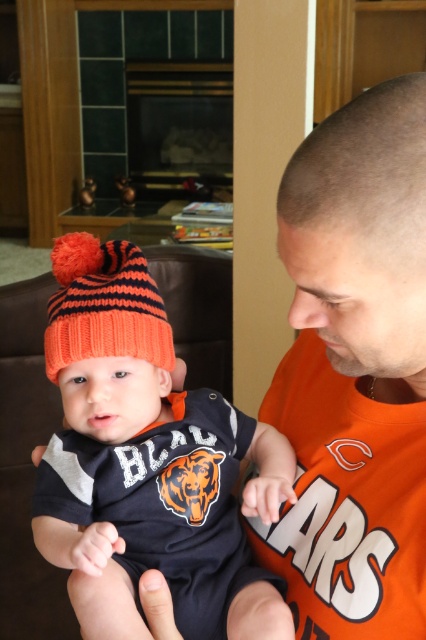
You are standing in the living room and want to reach the point marked at coordinates (69,540). If your arm is 24 inches long, can you touch that point without moving your body?

The point marked at coordinates (69,540) is 27.10 inches away from you. Since your arm is only 24 inches long, you cannot reach it without moving your body.